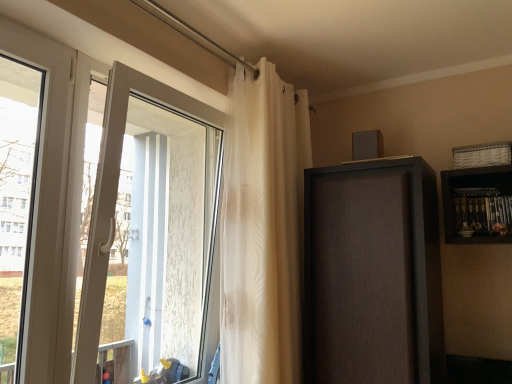
Question: Can you confirm if matte brown cabinet at upper right is thinner than white plastic window at left?

Choices:
 (A) no
 (B) yes

Answer: (A)

Question: Would you say white plastic window at left is part of matte brown cabinet at upper right's contents?

Choices:
 (A) no
 (B) yes

Answer: (A)

Question: Considering the relative positions of matte brown cabinet at upper right and white plastic window at left in the image provided, is matte brown cabinet at upper right to the left of white plastic window at left from the viewer's perspective?

Choices:
 (A) yes
 (B) no

Answer: (B)

Question: Does matte brown cabinet at upper right appear on the right side of white plastic window at left?

Choices:
 (A) no
 (B) yes

Answer: (B)

Question: From the image's perspective, is matte brown cabinet at upper right under white plastic window at left?

Choices:
 (A) no
 (B) yes

Answer: (B)

Question: From a real-world perspective, is matte brown cabinet at upper right over white plastic window at left?

Choices:
 (A) no
 (B) yes

Answer: (A)

Question: Does translucent white curtain at upper center lie behind white plastic window at left?

Choices:
 (A) no
 (B) yes

Answer: (B)

Question: Are translucent white curtain at upper center and white plastic window at left located far from each other?

Choices:
 (A) yes
 (B) no

Answer: (B)

Question: Is translucent white curtain at upper center positioned in front of white plastic window at left?

Choices:
 (A) yes
 (B) no

Answer: (B)

Question: Is translucent white curtain at upper center outside of white plastic window at left?

Choices:
 (A) no
 (B) yes

Answer: (B)

Question: Does translucent white curtain at upper center appear on the right side of white plastic window at left?

Choices:
 (A) no
 (B) yes

Answer: (B)

Question: Could you tell me if translucent white curtain at upper center is facing white plastic window at left?

Choices:
 (A) yes
 (B) no

Answer: (B)

Question: Is matte brown cabinet at upper right taller than white glossy door at left?

Choices:
 (A) yes
 (B) no

Answer: (B)